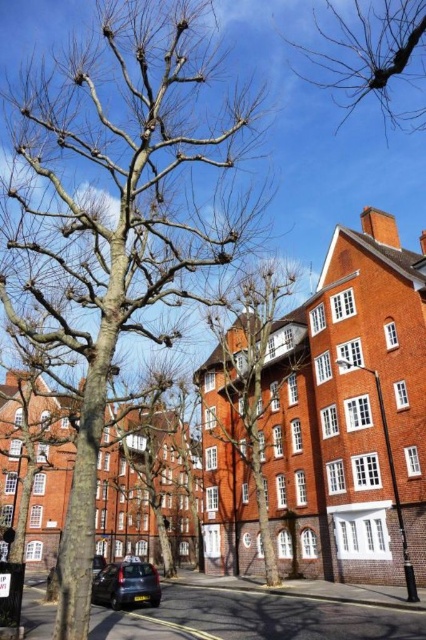
Question: Which point is farther to the camera?

Choices:
 (A) (425, 92)
 (B) (287, 337)
 (C) (150, 92)
 (D) (135, 600)

Answer: (A)

Question: Can you confirm if bare wood tree at center is positioned to the right of bare branches at upper right?

Choices:
 (A) yes
 (B) no

Answer: (B)

Question: Estimate the real-world distances between objects in this image. Which object is closer to the bare branches at center?

Choices:
 (A) bare branches at upper right
 (B) shiny black car at lower left
 (C) bare wood tree at center

Answer: (C)

Question: Can you confirm if bare branches at upper right is bigger than shiny black car at lower left?

Choices:
 (A) no
 (B) yes

Answer: (B)

Question: Is bare branches at upper right positioned at the back of shiny black car at lower left?

Choices:
 (A) no
 (B) yes

Answer: (A)

Question: Which point is farther from the camera taking this photo?

Choices:
 (A) (101, 97)
 (B) (367, 52)
 (C) (132, 564)
 (D) (273, 333)

Answer: (B)